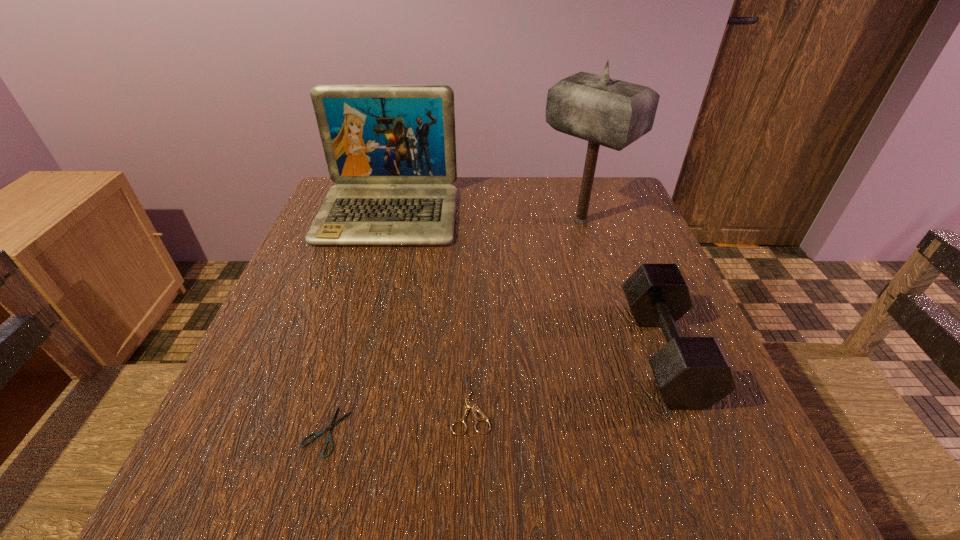
Locate an element on the screen. Image resolution: width=960 pixels, height=540 pixels. free space between the shorter shears and the third object from left to right is located at coordinates (398, 417).

The image size is (960, 540). Find the location of `free point between the second tallest object and the tallest object`. free point between the second tallest object and the tallest object is located at coordinates tap(485, 218).

The height and width of the screenshot is (540, 960). I want to click on empty space that is in between the tallest object and the laptop computer, so click(x=485, y=218).

Where is `vacant space that is in between the tallest object and the left shears`? vacant space that is in between the tallest object and the left shears is located at coordinates (453, 326).

Where is `empty space between the tallest object and the third object from right to left`? This screenshot has width=960, height=540. empty space between the tallest object and the third object from right to left is located at coordinates (526, 312).

Identify the location of object that ranks as the closest to the right shears. (330, 428).

Where is `object that stands as the closest to the fourth shortest object`? Image resolution: width=960 pixels, height=540 pixels. object that stands as the closest to the fourth shortest object is located at coordinates (604, 111).

This screenshot has width=960, height=540. I want to click on free spot that satisfies the following two spatial constraints: 1. on the back side of the third tallest object; 2. on the left side of the taller shears, so click(472, 352).

You are a GUI agent. You are given a task and a screenshot of the screen. Output one action in this format:
    pyautogui.click(x=<x>, y=<y>)
    Task: Click on the free space that satisfies the following two spatial constraints: 1. on the screen of the third tallest object; 2. on the right side of the laptop computer
    
    Given the screenshot: What is the action you would take?
    pyautogui.click(x=348, y=352)

Find the location of a particular element. This screenshot has width=960, height=540. blank space that satisfies the following two spatial constraints: 1. on the screen of the fourth shortest object; 2. on the right side of the third object from left to right is located at coordinates (334, 403).